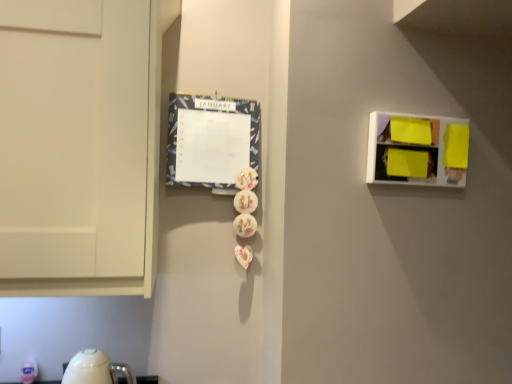
Question: From the image's perspective, is blue fabric calendar at center-left on top of bright yellow plastic at upper right?

Choices:
 (A) yes
 (B) no

Answer: (A)

Question: Is blue fabric calendar at center-left taller than bright yellow plastic at upper right?

Choices:
 (A) yes
 (B) no

Answer: (A)

Question: Does blue fabric calendar at center-left lie behind bright yellow plastic at upper right?

Choices:
 (A) yes
 (B) no

Answer: (A)

Question: Considering the relative positions of blue fabric calendar at center-left and bright yellow plastic at upper right in the image provided, is blue fabric calendar at center-left to the left of bright yellow plastic at upper right from the viewer's perspective?

Choices:
 (A) no
 (B) yes

Answer: (B)

Question: Is blue fabric calendar at center-left closer to camera compared to bright yellow plastic at upper right?

Choices:
 (A) yes
 (B) no

Answer: (B)

Question: Is blue fabric calendar at center-left smaller than bright yellow plastic at upper right?

Choices:
 (A) yes
 (B) no

Answer: (B)

Question: Is bright yellow plastic at upper right oriented away from blue fabric calendar at center-left?

Choices:
 (A) yes
 (B) no

Answer: (B)

Question: From the image's perspective, does bright yellow plastic at upper right appear higher than blue fabric calendar at center-left?

Choices:
 (A) yes
 (B) no

Answer: (B)

Question: Is bright yellow plastic at upper right in front of blue fabric calendar at center-left?

Choices:
 (A) yes
 (B) no

Answer: (A)

Question: From the image's perspective, is bright yellow plastic at upper right under blue fabric calendar at center-left?

Choices:
 (A) no
 (B) yes

Answer: (B)

Question: Are bright yellow plastic at upper right and blue fabric calendar at center-left located far from each other?

Choices:
 (A) yes
 (B) no

Answer: (B)

Question: From a real-world perspective, is bright yellow plastic at upper right under blue fabric calendar at center-left?

Choices:
 (A) no
 (B) yes

Answer: (B)

Question: Based on their sizes in the image, would you say bright yellow plastic at upper right is bigger or smaller than blue fabric calendar at center-left?

Choices:
 (A) big
 (B) small

Answer: (B)